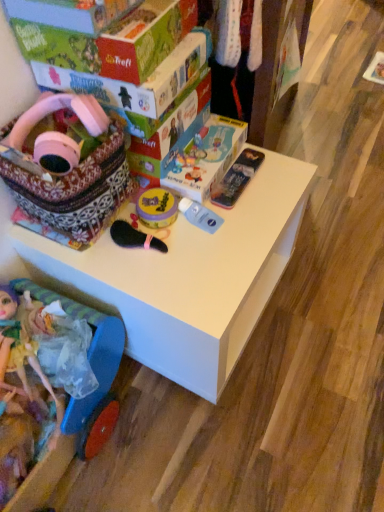
Find the location of a particular element. free space on the front side of white matte table at center is located at coordinates (244, 440).